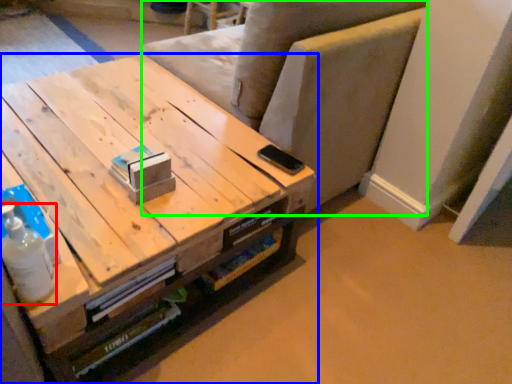
Question: Based on their relative distances, which object is nearer to bottle (highlighted by a red box)? Choose from table (highlighted by a blue box) and armchair (highlighted by a green box).

Choices:
 (A) table
 (B) armchair

Answer: (A)